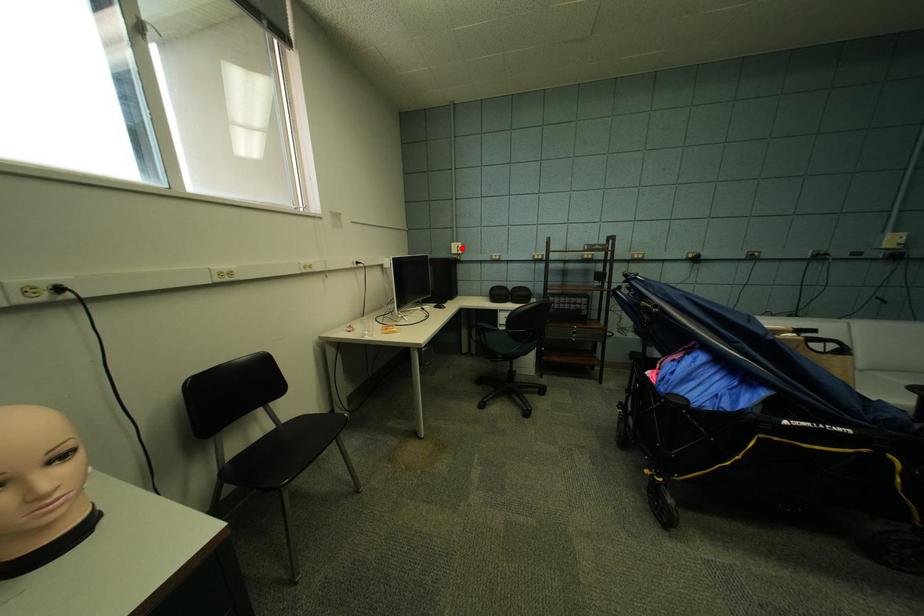
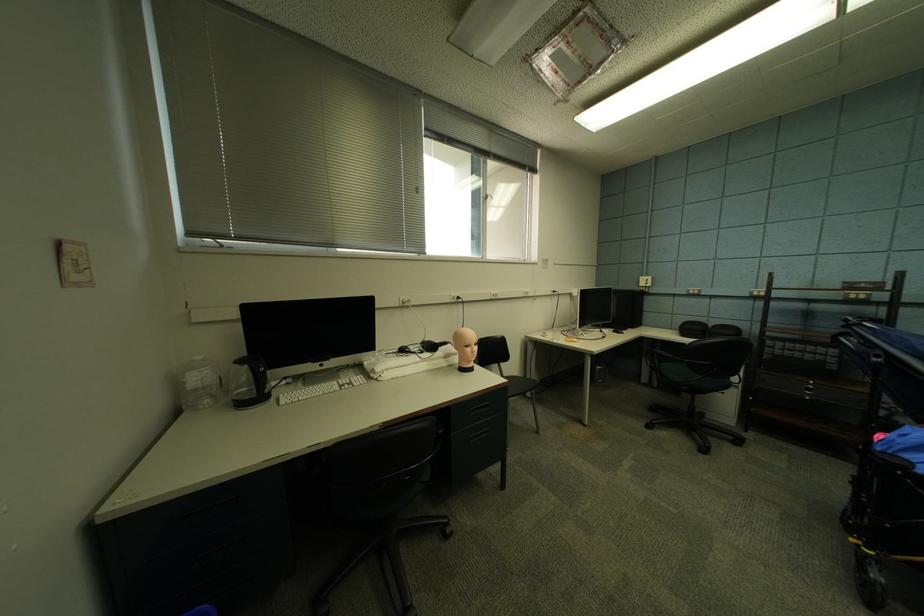
Where in the second image is the point corresponding to the highlighted location from the first image?

(650, 282)